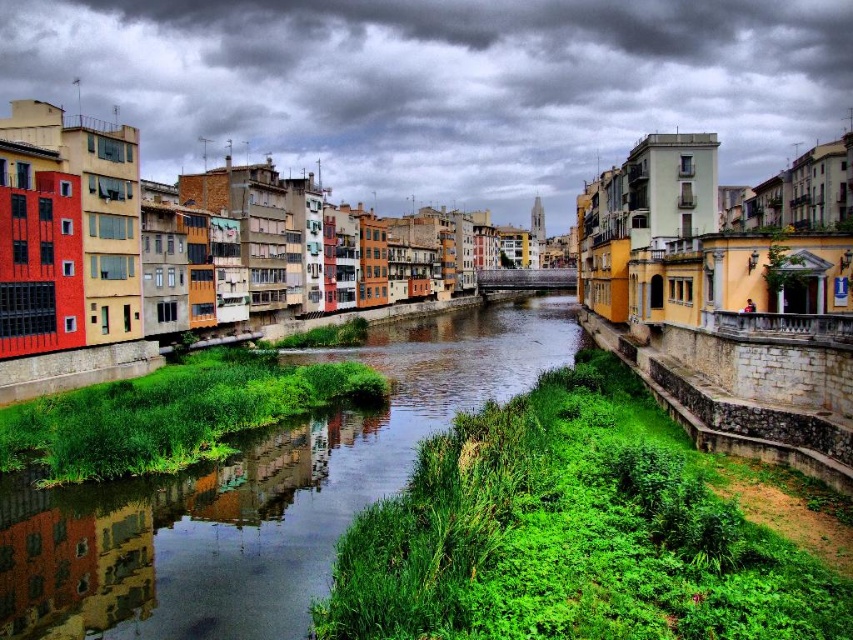
Where is `cloudy sky at upper center`? This screenshot has width=853, height=640. cloudy sky at upper center is located at coordinates (440, 84).

Does cloudy sky at upper center appear over green grassy bank at center?

Indeed, cloudy sky at upper center is positioned over green grassy bank at center.

Locate an element on the screen. cloudy sky at upper center is located at coordinates (440, 84).

At what (x,y) coordinates should I click in order to perform the action: click on cloudy sky at upper center. Please return your answer as a coordinate pair (x, y). Looking at the image, I should click on (440, 84).